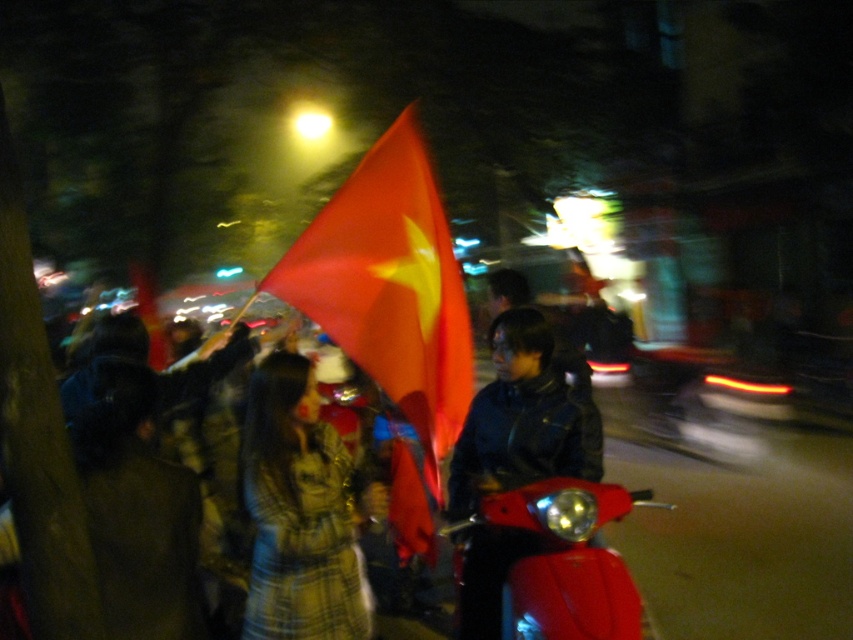
Question: Is plaid fabric coat at center smaller than shiny black jacket at center?

Choices:
 (A) no
 (B) yes

Answer: (A)

Question: Which object is farther from the camera taking this photo?

Choices:
 (A) shiny black jacket at center
 (B) shiny red motorbike at lower right

Answer: (A)

Question: Is matte red flag at center closer to the viewer compared to plaid fabric coat at center?

Choices:
 (A) yes
 (B) no

Answer: (B)

Question: Can you confirm if shiny black jacket at center is positioned above shiny red motorbike at lower right?

Choices:
 (A) no
 (B) yes

Answer: (B)

Question: Considering the real-world distances, which object is closest to the shiny black jacket at center?

Choices:
 (A) plaid wool coat at center
 (B) matte red flag at center
 (C) shiny red motorbike at lower right
 (D) plaid fabric coat at center

Answer: (C)

Question: Which object is positioned closest to the plaid fabric coat at center?

Choices:
 (A) shiny red motorbike at lower right
 (B) shiny black jacket at center

Answer: (B)